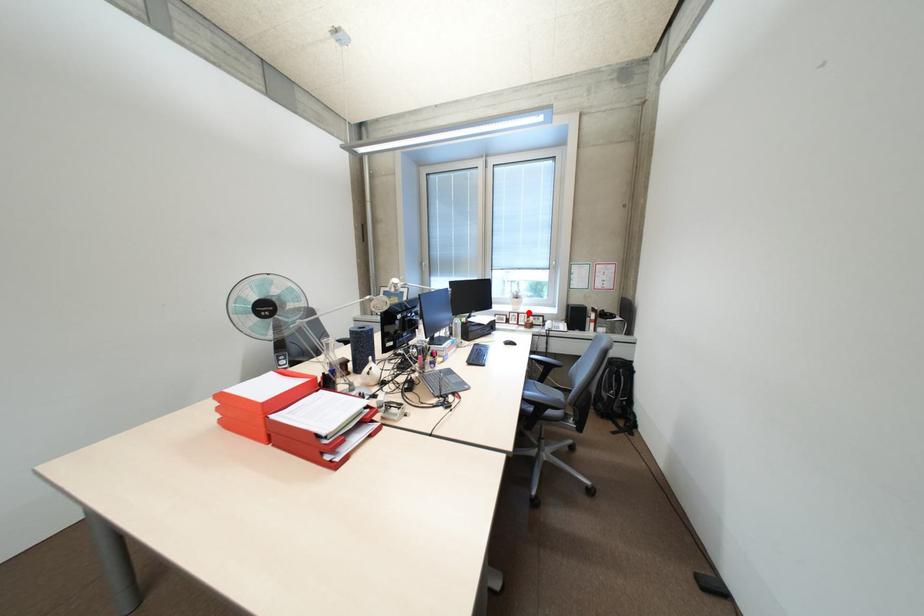
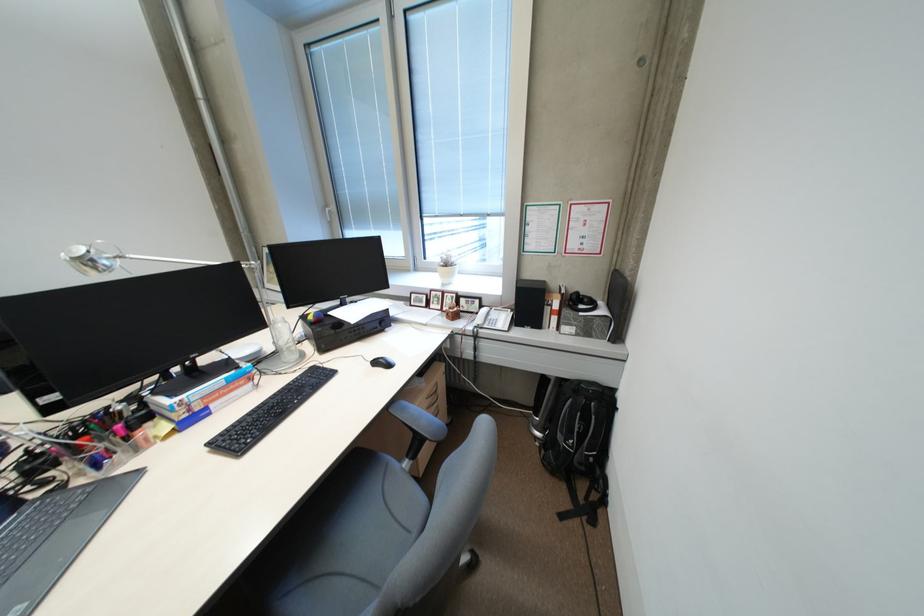
The point at the highlighted location is marked in the first image. Where is the corresponding point in the second image?

(454, 292)